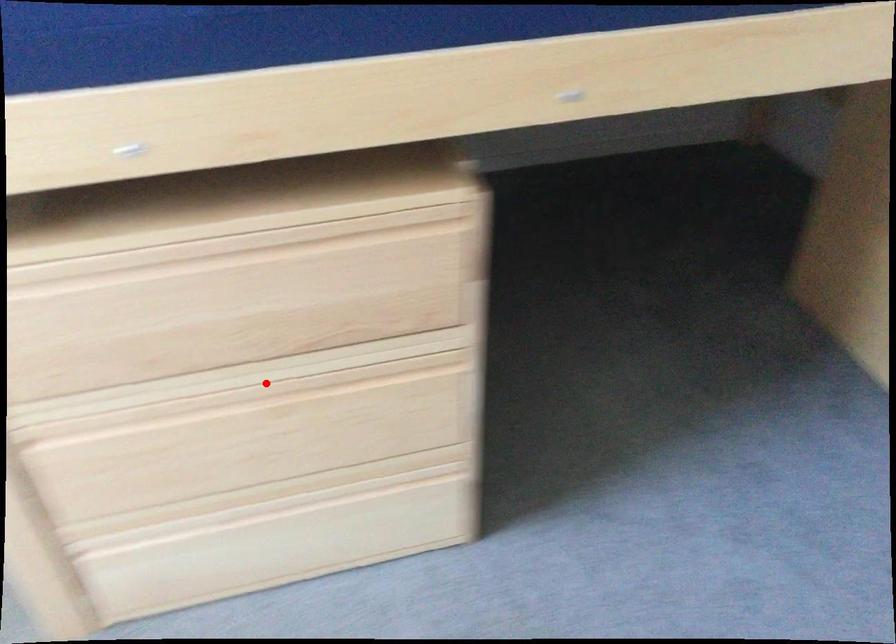
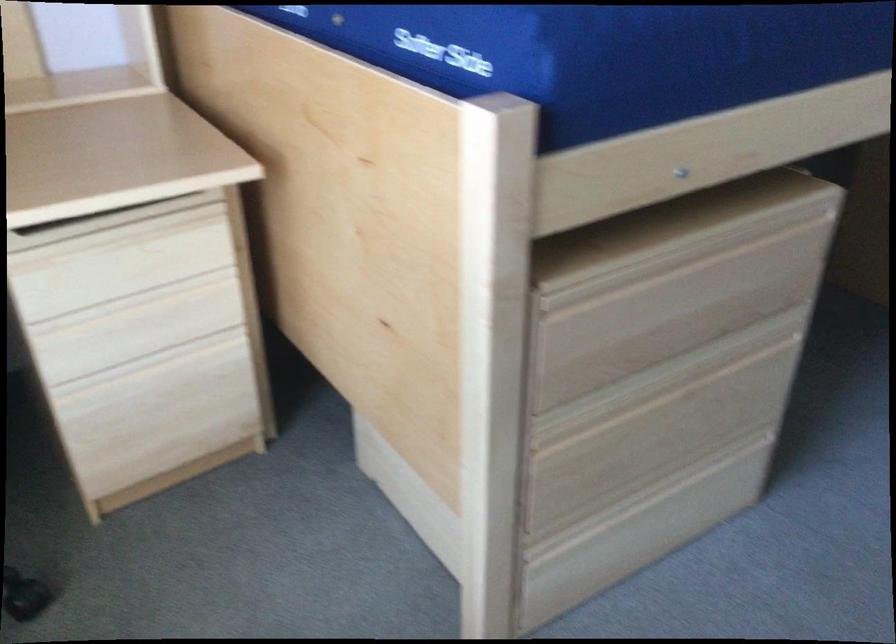
The point at the highlighted location is marked in the first image. Where is the corresponding point in the second image?

(673, 377)